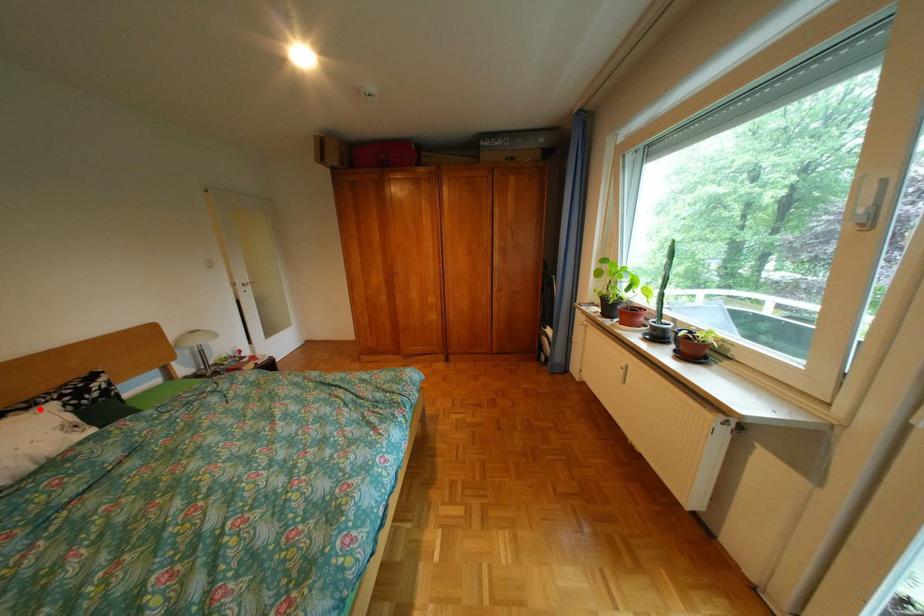
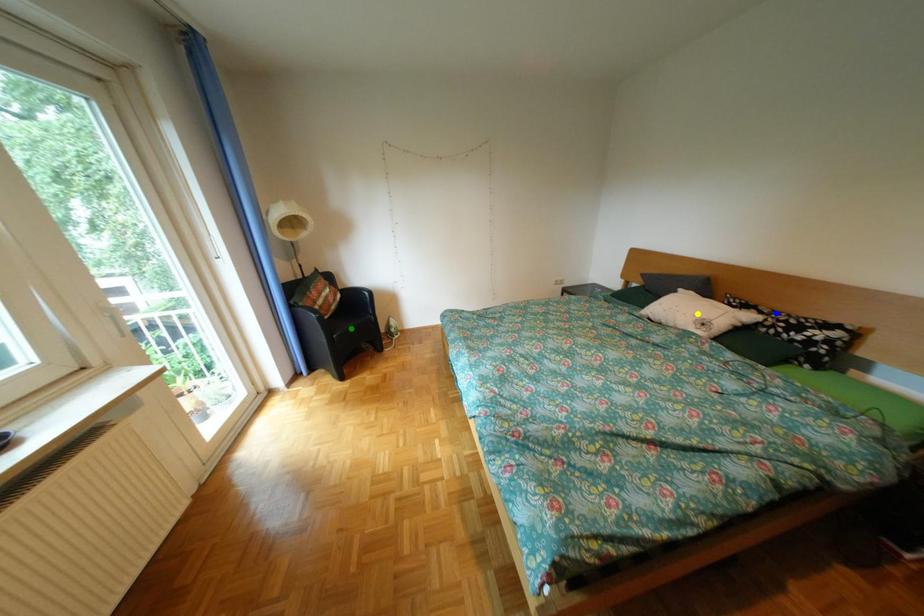
Question: I am providing you with two images of the same scene from different viewpoints. A red point is marked on the first image. You are given multiple points on the second image. Can you choose the point in image 2 that corresponds to the point in image 1?

Choices:
 (A) green point
 (B) yellow point
 (C) blue point

Answer: (C)